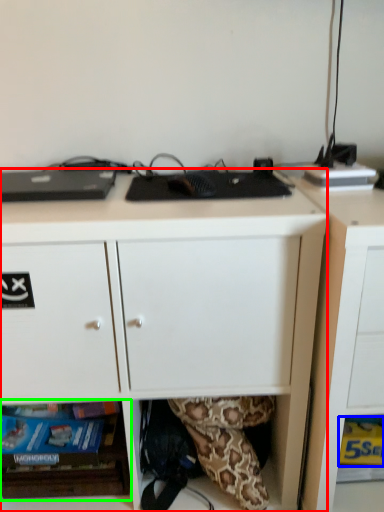
Question: Considering the real-world distances, which object is closest to desk (highlighted by a red box)? paperback book (highlighted by a blue box) or shelf (highlighted by a green box).

Choices:
 (A) paperback book
 (B) shelf

Answer: (B)